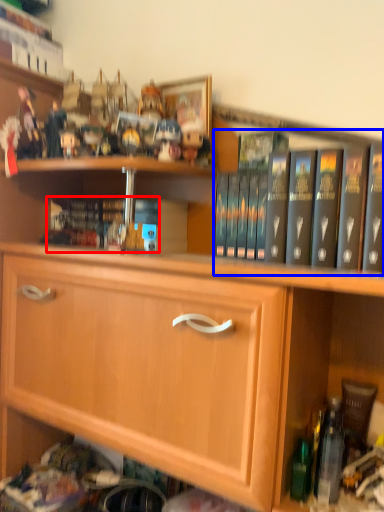
Question: Which object appears closest to the camera in this image, book (highlighted by a red box) or book (highlighted by a blue box)?

Choices:
 (A) book
 (B) book

Answer: (B)